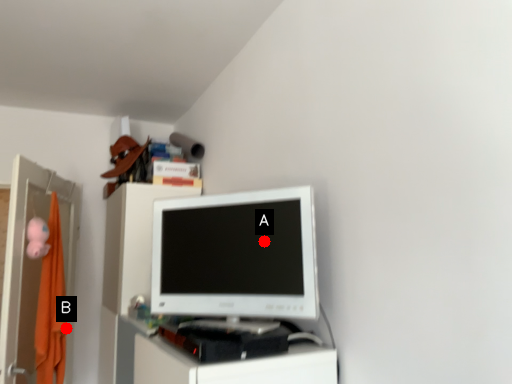
Question: Two points are circled on the image, labeled by A and B beside each circle. Which point appears closest to the camera in this image?

Choices:
 (A) A is closer
 (B) B is closer

Answer: (A)